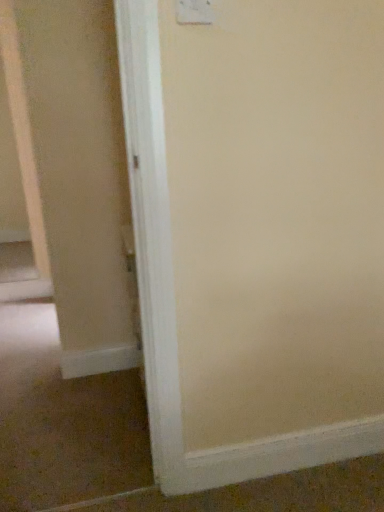
Image resolution: width=384 pixels, height=512 pixels. Describe the element at coordinates (194, 12) in the screenshot. I see `white plastic light switch at upper center` at that location.

Find the location of a particular element. The height and width of the screenshot is (512, 384). white plastic light switch at upper center is located at coordinates (194, 12).

Locate an element on the screen. The height and width of the screenshot is (512, 384). white plastic light switch at upper center is located at coordinates (194, 12).